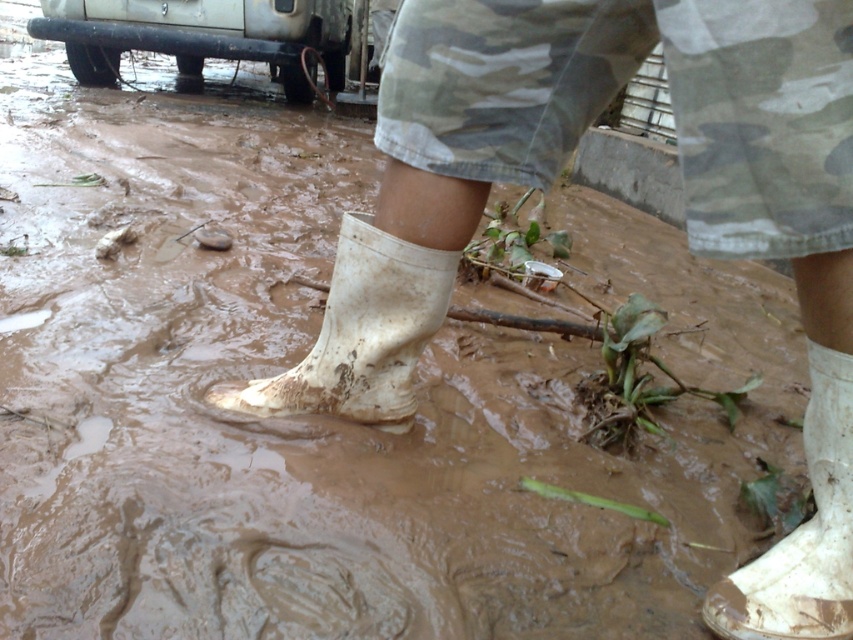
Question: Which of the following is the farthest from the observer?

Choices:
 (A) white rubber boot at center
 (B) silver metallic bumper at upper left

Answer: (B)

Question: Is white rubber boot at center wider than white matte boot at lower right?

Choices:
 (A) no
 (B) yes

Answer: (B)

Question: Which point appears farthest from the camera in this image?

Choices:
 (A) (221, 404)
 (B) (729, 616)
 (C) (164, 22)

Answer: (C)

Question: Can you confirm if white matte boot at lower right is wider than silver metallic bumper at upper left?

Choices:
 (A) yes
 (B) no

Answer: (B)

Question: Is white matte boot at lower right thinner than silver metallic bumper at upper left?

Choices:
 (A) yes
 (B) no

Answer: (A)

Question: Based on their relative distances, which object is nearer to the white rubber boot at center?

Choices:
 (A) silver metallic bumper at upper left
 (B) white matte boot at lower right

Answer: (B)